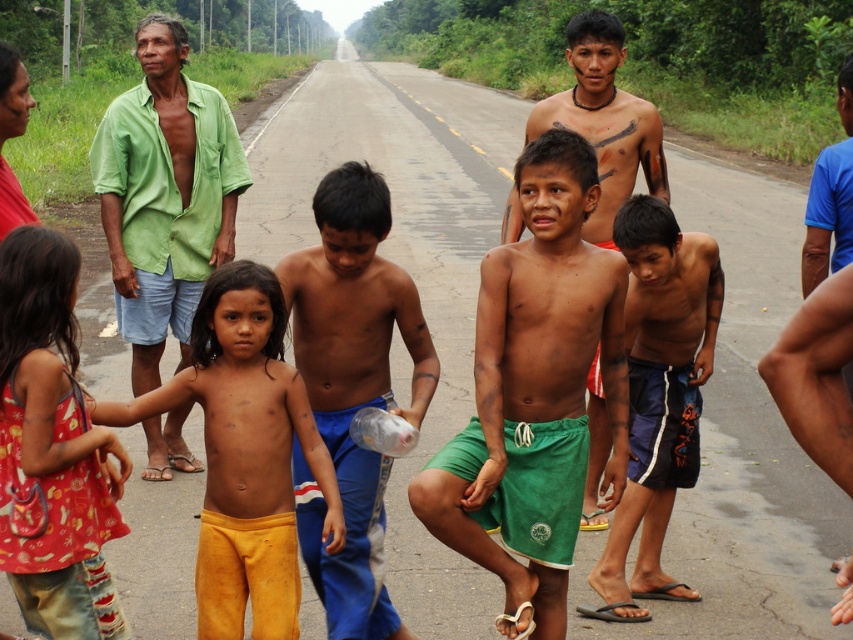
Question: Can you confirm if green cotton shirt at left is smaller than dark blue shorts at center?

Choices:
 (A) no
 (B) yes

Answer: (A)

Question: Among these points, which one is farthest from the camera?

Choices:
 (A) (625, 52)
 (B) (647, 390)
 (C) (3, 445)

Answer: (A)

Question: Which of the following is the closest to the observer?

Choices:
 (A) (125, 193)
 (B) (260, 568)
 (C) (363, 451)

Answer: (B)

Question: Is yellow cotton pants at center to the right of dark blue shorts at center from the viewer's perspective?

Choices:
 (A) no
 (B) yes

Answer: (A)

Question: Based on their relative distances, which object is nearer to the green cotton shorts at center?

Choices:
 (A) dark blue shorts at center
 (B) yellow cotton pants at center
 (C) green cotton shirt at left
 (D) red printed dress at center

Answer: (B)

Question: Is green cotton shorts at center bigger than dark blue shorts at center?

Choices:
 (A) yes
 (B) no

Answer: (B)